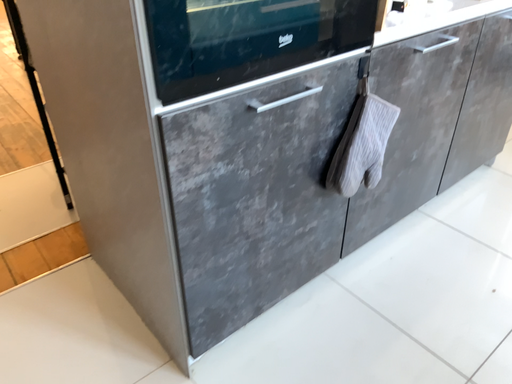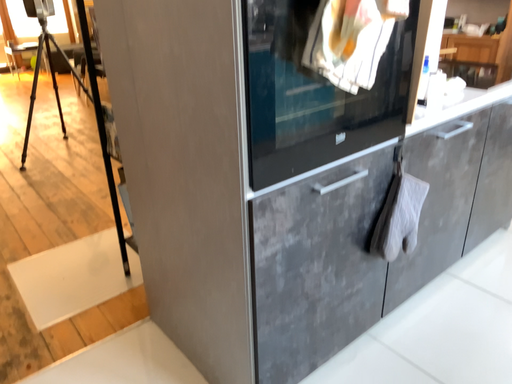
Question: How did the camera likely rotate when shooting the video?

Choices:
 (A) rotated downward
 (B) rotated upward

Answer: (B)